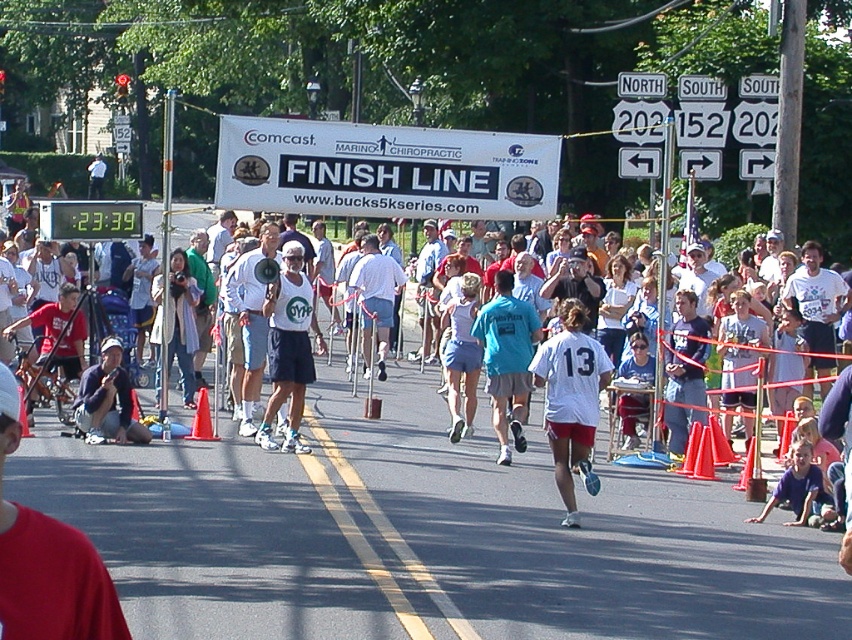
You are a photographer at the finish line and want to capture both the teal fabric shirt at center and the dark blue shorts at lower left in the same photo. Based on their positions, where should you position the camera to include both?

The teal fabric shirt at center is to the right of dark blue shorts at lower left, so positioning the camera centrally between them would ensure both are captured in the frame.

You are a photographer at the finish line and need to capture both the teal fabric shirt at center and the dark blue shorts at lower left in a single shot. Which object should you focus on first to ensure both are in frame?

You should focus on the teal fabric shirt at center first since it is in front of the dark blue shorts at lower left, ensuring both will be captured when adjusting the camera angle accordingly.

You are a photographer at the finish line of a 5K race. You want to capture a photo of the white matte shirt at center and the light blue shorts at center. Which one is on the right side when looking at the scene?

The white matte shirt at center is positioned on the right side of light blue shorts at center, so the white matte shirt at center is on the right.